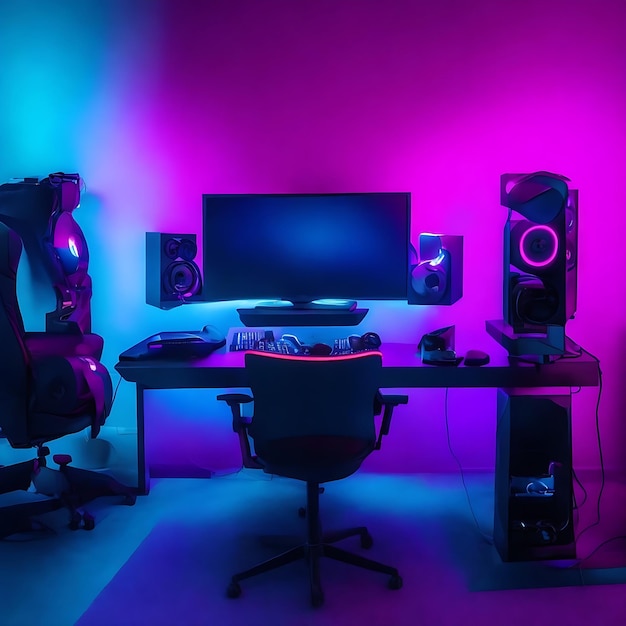
Where is `cables`? This screenshot has height=626, width=626. cables is located at coordinates (456, 459), (602, 451), (578, 486), (572, 510), (576, 355), (116, 390).